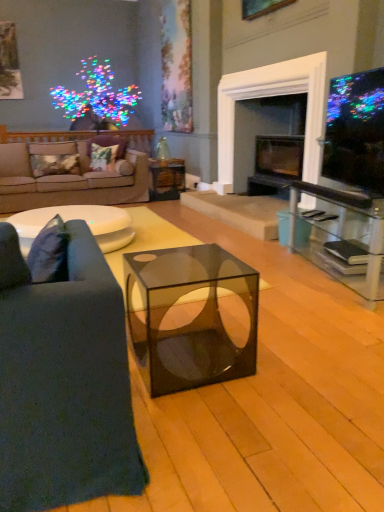
Locate an element on the screen. The height and width of the screenshot is (512, 384). vacant area that is in front of clear glass entertainment center at right is located at coordinates (321, 321).